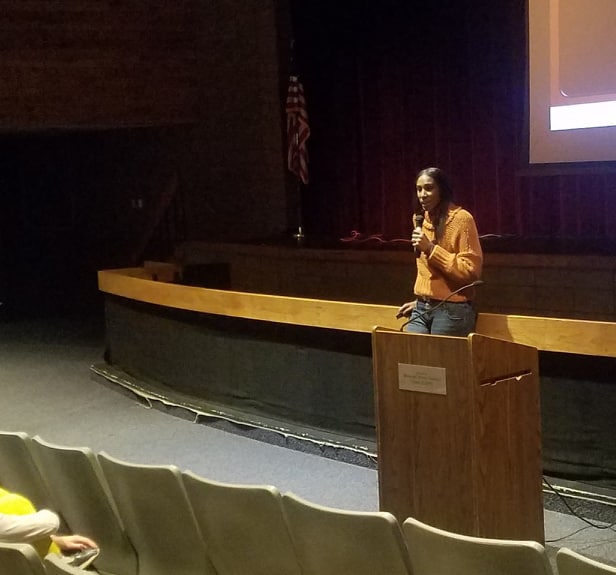
Locate an element on the screen. This screenshot has width=616, height=575. seats is located at coordinates (569, 562), (464, 557), (351, 542), (209, 521), (129, 494), (60, 476), (17, 471), (9, 558), (54, 567).